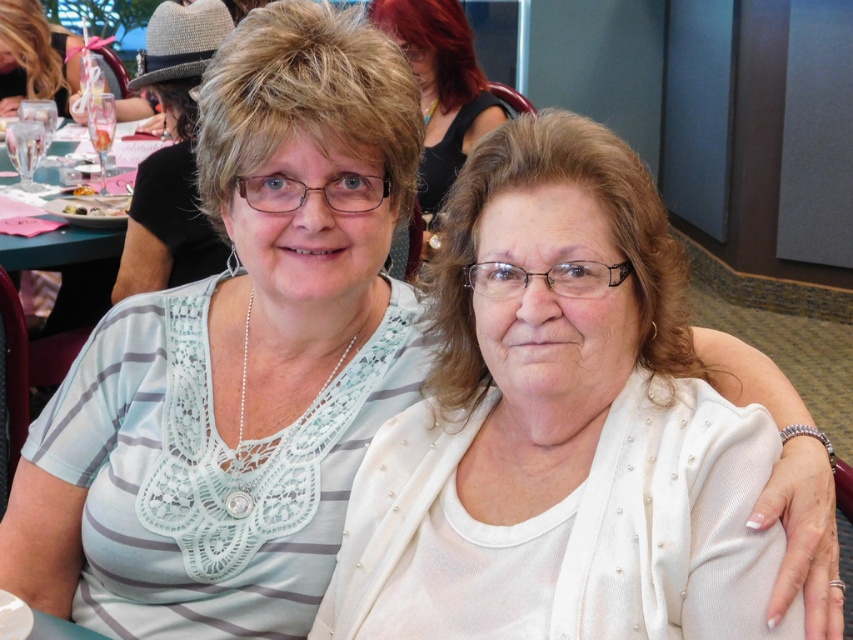
You are a photographer at a social event and need to capture a closeup of the white pearl cardigan at center without including the green plastic table at left in the frame. Given their distance, is this feasible?

The white pearl cardigan at center and green plastic table at left are 7.15 feet apart, so yes, it is feasible to capture a closeup of the white pearl cardigan at center without including the green plastic table at left in the frame as they are sufficiently separated.

You are at a social event and want to hand a drink to the woman wearing the white pearl cardigan at center. The translucent plastic cup at upper left is currently in your hand. Can you directly hand the cup to her without moving your position?

The white pearl cardigan at center is closer to the viewer than the translucent plastic cup at upper left, so you cannot directly hand the cup to her without moving your position because the cup is farther away from her.

You are a photographer at the event and need to capture a photo of the two women. The white pearl cardigan at center and the green plastic table at left are in the frame. Based on their positions, which object is closer to the camera?

The white pearl cardigan at center is closer to the camera because it is positioned below the green plastic table at left, indicating it is lower in the frame and likely nearer to the viewer.